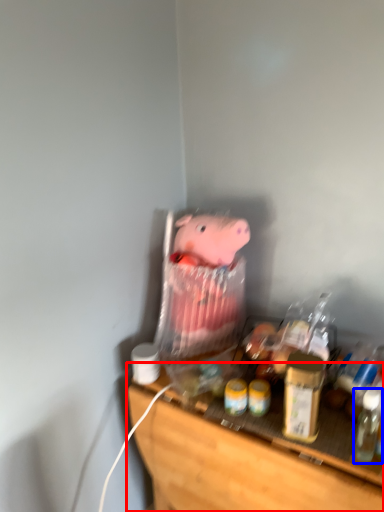
Question: Which point is closer to the camera, furniture (highlighted by a red box) or bottle (highlighted by a blue box)?

Choices:
 (A) furniture
 (B) bottle

Answer: (A)